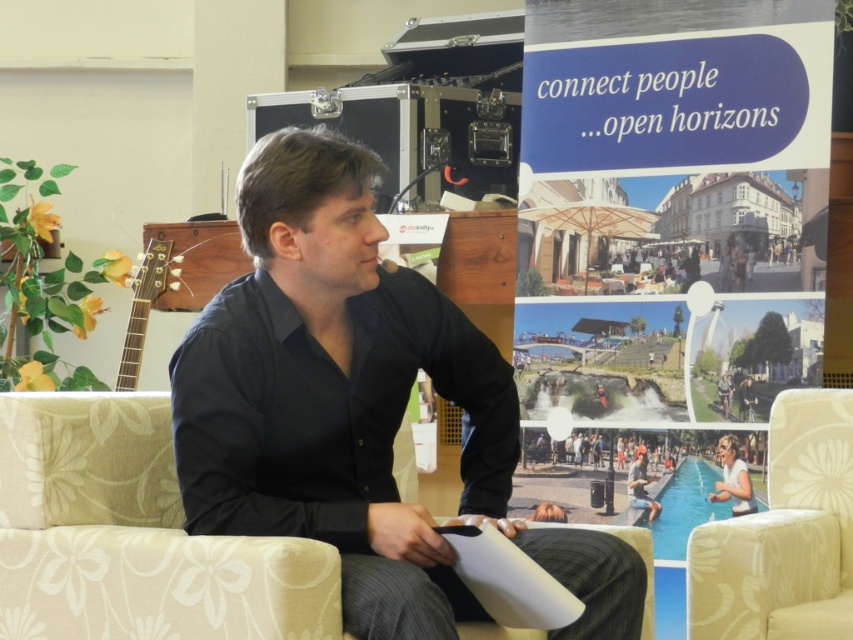
Where is `beige floral fabric armchair at lower right`? beige floral fabric armchair at lower right is located at coordinates (784, 536).

Is beige floral fabric armchair at lower right below matte black shirt at center?

Actually, beige floral fabric armchair at lower right is above matte black shirt at center.

I want to click on beige floral fabric armchair at lower right, so click(x=784, y=536).

Is blue paper sign at upper right smaller than beige floral fabric armchair at lower right?

No.

Can you confirm if blue paper sign at upper right is taller than beige floral fabric armchair at lower right?

Indeed, blue paper sign at upper right has a greater height compared to beige floral fabric armchair at lower right.

Who is more forward, (757, 204) or (816, 620)?

Point (816, 620) is in front.

You are a GUI agent. You are given a task and a screenshot of the screen. Output one action in this format:
    pyautogui.click(x=<x>, y=<y>)
    Task: Click on the blue paper sign at upper right
    Image resolution: width=853 pixels, height=640 pixels.
    Given the screenshot: What is the action you would take?
    pyautogui.click(x=695, y=176)

Can you confirm if beige fabric couch at center is taller than matte black shirt at center?

Yes.

Does point (648, 632) come in front of point (643, 492)?

Yes, it is.

This screenshot has height=640, width=853. Identify the location of beige fabric couch at center. (134, 536).